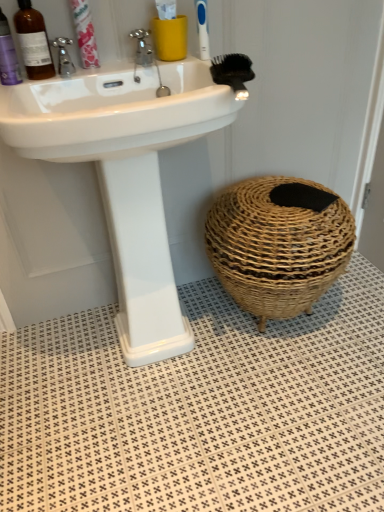
Question: Is point (13, 58) closer or farther from the camera than point (160, 29)?

Choices:
 (A) farther
 (B) closer

Answer: (B)

Question: Is matte purple bottle at left, which appears as the first mouthwash when viewed from the left, bigger or smaller than matte yellow cup at upper center?

Choices:
 (A) small
 (B) big

Answer: (A)

Question: Which is farther from the brushed metal faucet at upper left, marked as the 2th tap in a right-to-left arrangement?

Choices:
 (A) black bristle brush at upper right
 (B) blue plastic toothbrush at upper center
 (C) matte yellow cup at upper center
 (D) braided wicker basket at lower right
 (E) pink paper toothpaste at upper left

Answer: (D)

Question: Which object is positioned closest to the metallic chrome faucet at upper center, the 2th tap viewed from the left?

Choices:
 (A) white glossy sink at upper center
 (B) pink paper toothpaste at upper left
 (C) braided wicker basket at lower right
 (D) matte yellow cup at upper center
 (E) white textured tile at lower center

Answer: (D)